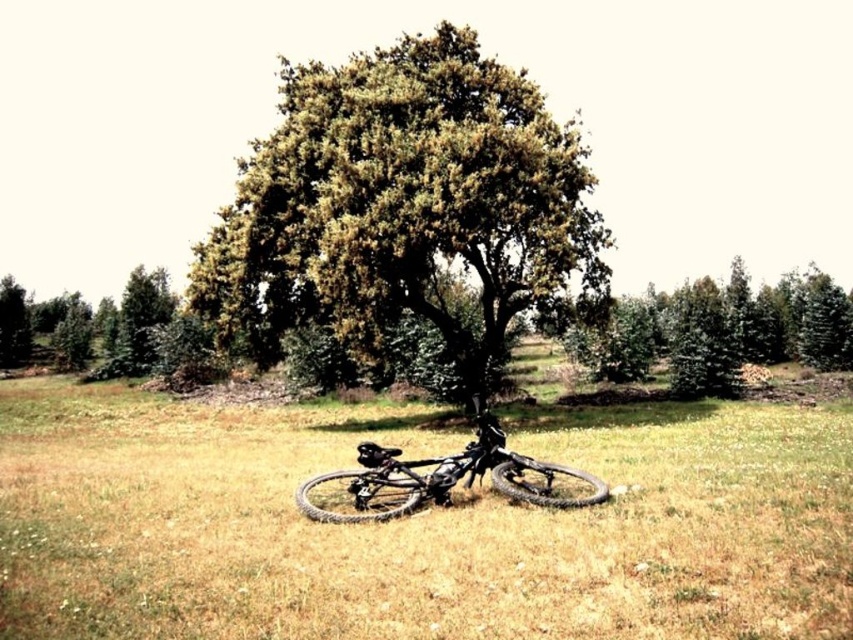
You are standing in the field and want to hide behind the taller tree. Which one should you choose between the green matte tree at left and the green leafy tree at left?

→ The green leafy tree at left is taller than the green matte tree at left, so you should hide behind the green leafy tree at left.

You are standing at the point with coordinates point (136, 360) and want to walk towards the tree. Which direction should you walk to reach the tree first, towards point (639, 310) or away from it?

You should walk towards point (639, 310) because it is in front of point (136, 360), meaning it is closer to the tree.